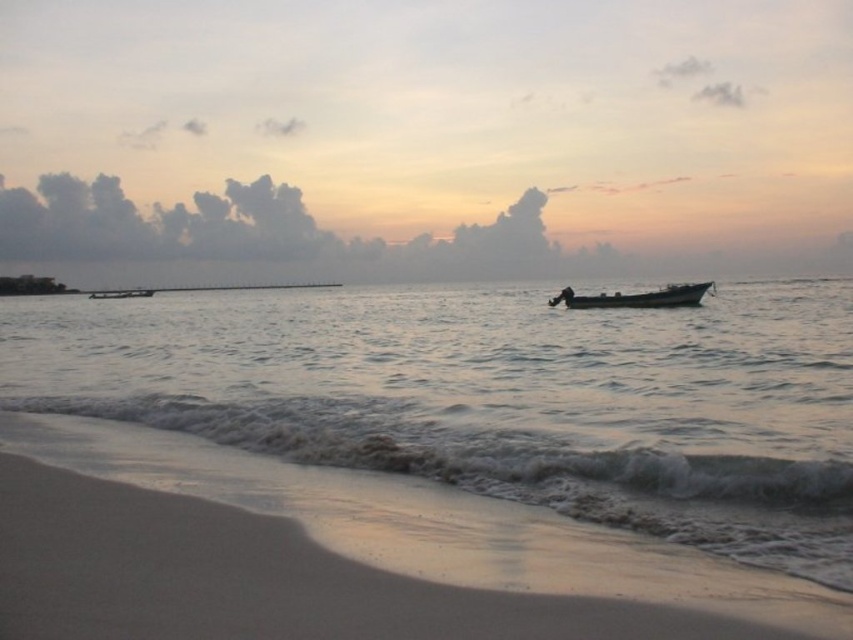
You are standing on the smooth sand at lower left and want to see the dark gray metallic boat at center. Can you see the boat from your current position?

The smooth sand at lower left is not as tall as dark gray metallic boat at center, so yes, you can see the boat from your current position because the boat is taller than the sand.

You are standing on the beach and want to walk to the dark gray metallic boat at center. Which direction should you head towards from the smooth sand at lower left?

To reach the dark gray metallic boat at center from the smooth sand at lower left, you should head upwards since the smooth sand at lower left is below the boat.